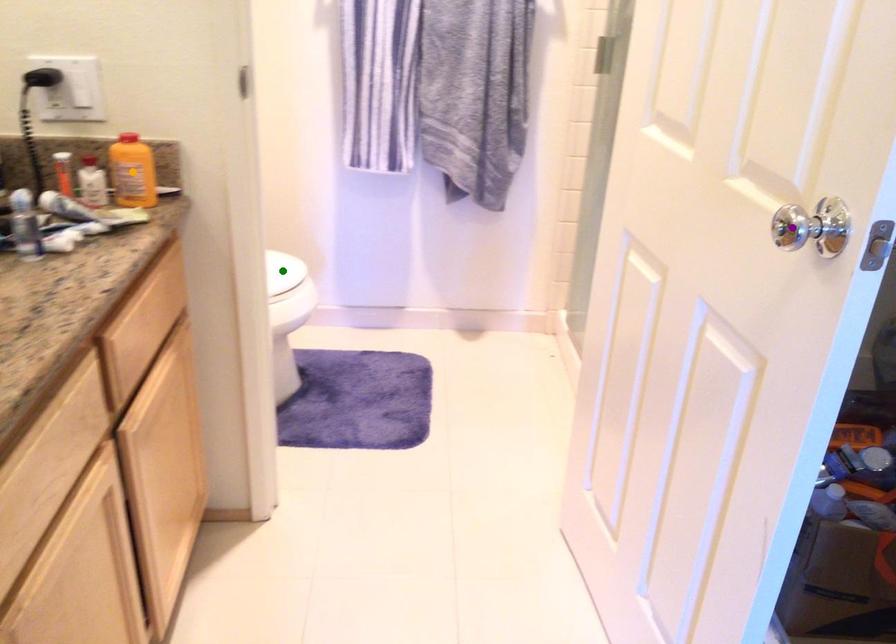
Order these from farthest to nearest:
A) purple point
B) green point
C) orange point

green point → orange point → purple point